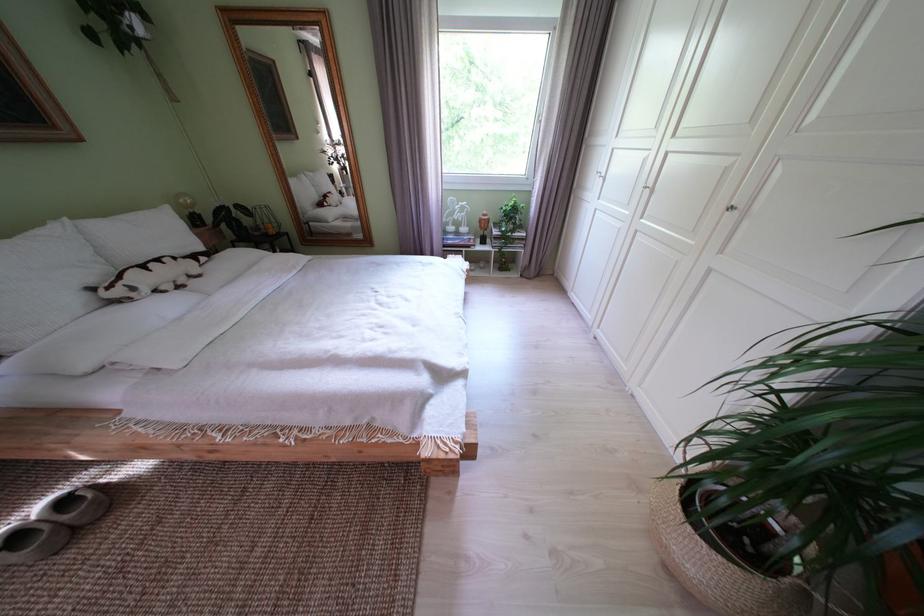
Describe the element at coordinates (51, 525) in the screenshot. I see `the brown slipper` at that location.